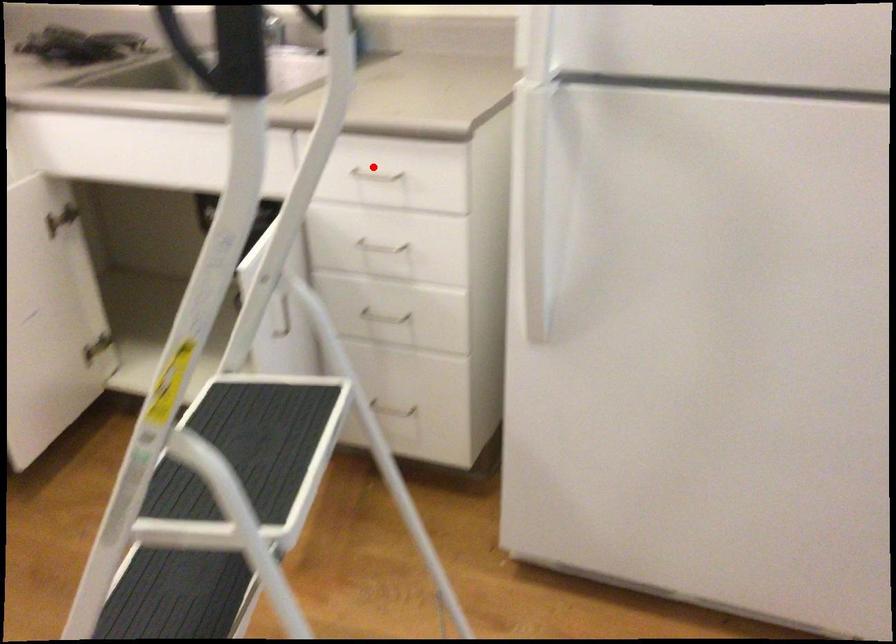
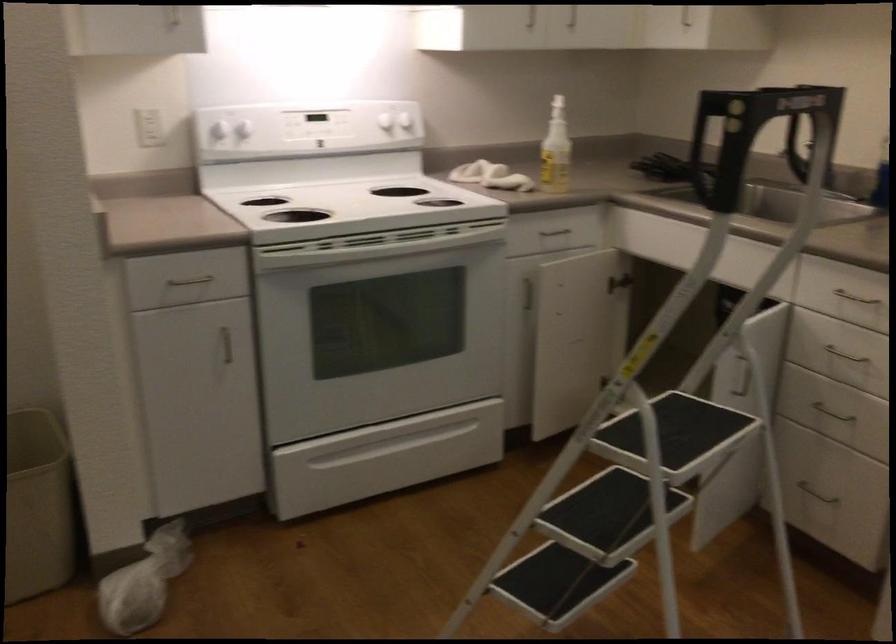
Question: I am providing you with two images of the same scene from different viewpoints. A red point is shown in image1. For the corresponding object point in image2, is it positioned nearer or farther from the camera?

Choices:
 (A) Nearer
 (B) Farther

Answer: (B)